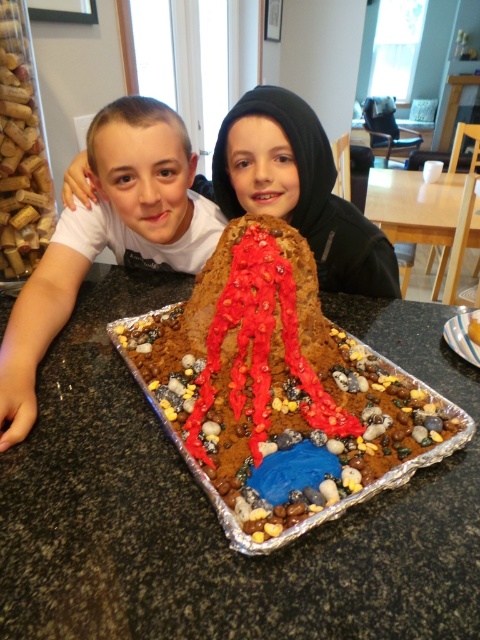
Question: Where is chocolate cake at center located in relation to matte brown hoodie at upper center in the image?

Choices:
 (A) above
 (B) below

Answer: (B)

Question: Can you confirm if matte white shirt at center is bigger than matte brown hoodie at upper center?

Choices:
 (A) yes
 (B) no

Answer: (A)

Question: Which of the following is the closest to the observer?

Choices:
 (A) (296, 115)
 (B) (271, 353)
 (C) (373, 193)
 (D) (180, 232)

Answer: (B)

Question: Which of these objects is positioned closest to the matte white shirt at center?

Choices:
 (A) light brown wooden table at upper right
 (B) matte brown hoodie at upper center

Answer: (B)

Question: Does matte white shirt at center appear on the right side of light brown wooden table at upper right?

Choices:
 (A) yes
 (B) no

Answer: (B)

Question: Considering the real-world distances, which object is farthest from the matte white shirt at center?

Choices:
 (A) matte brown hoodie at upper center
 (B) chocolate cake at center

Answer: (B)